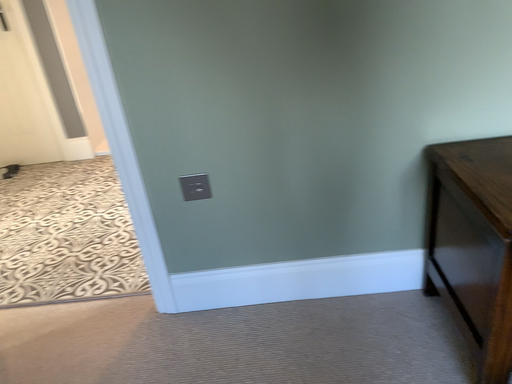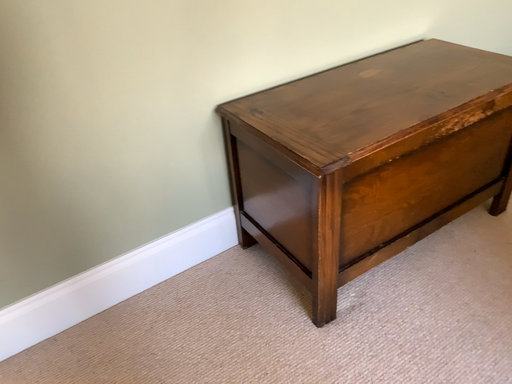
Question: How did the camera likely rotate when shooting the video?

Choices:
 (A) rotated right
 (B) rotated left

Answer: (A)